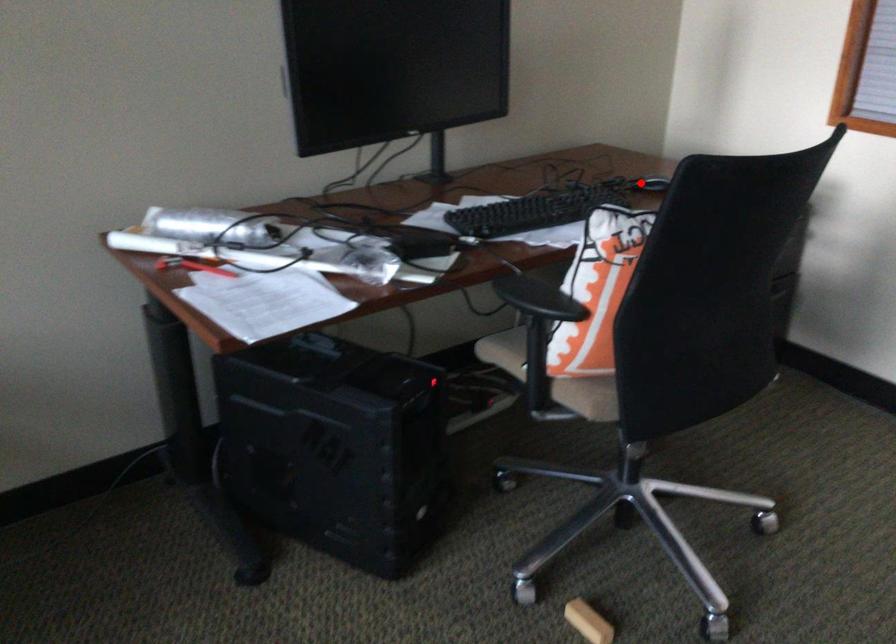
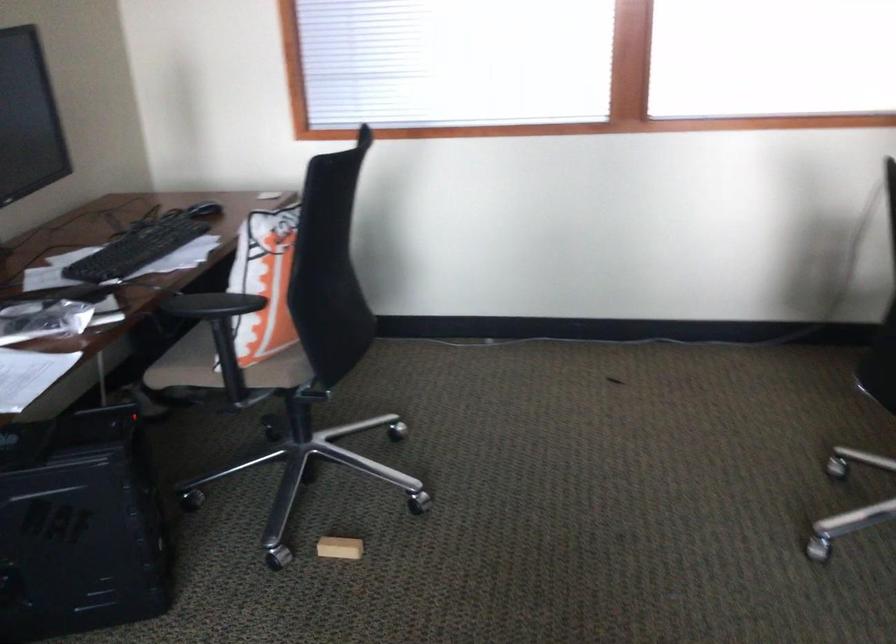
Question: I am providing you with two images of the same scene from different viewpoints. In image1, a red point is highlighted. Considering the same 3D point in image2, which of the following is correct?

Choices:
 (A) It is closer
 (B) It is farther

Answer: (B)